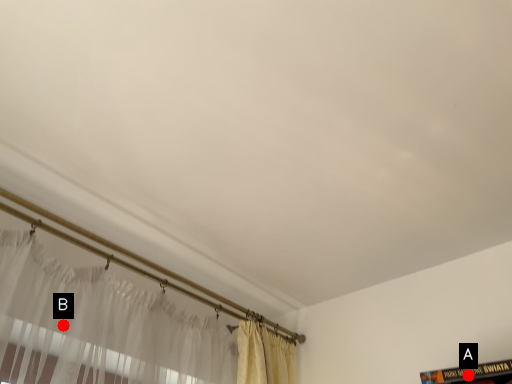
Question: Two points are circled on the image, labeled by A and B beside each circle. Which point is further to the camera?

Choices:
 (A) A is further
 (B) B is further

Answer: (A)